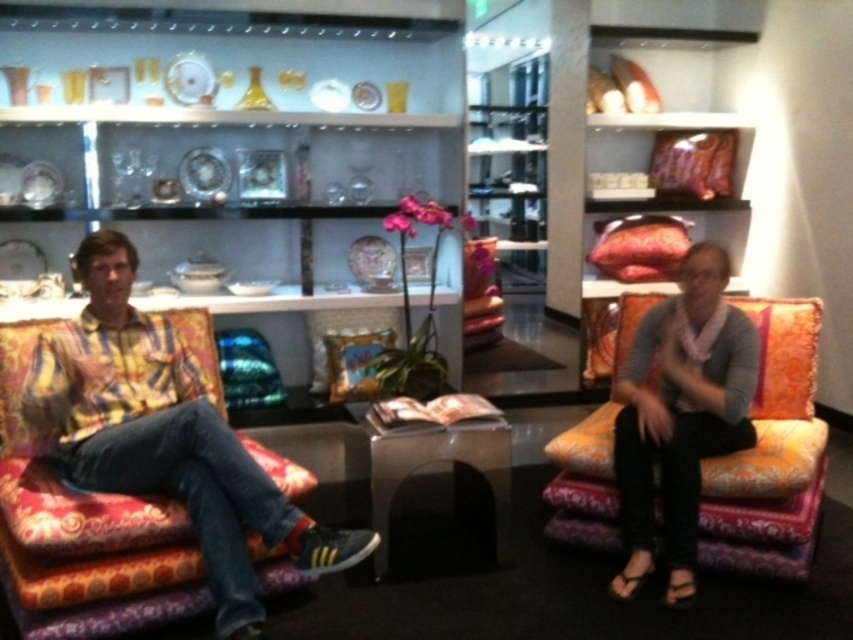
Question: Does printed fabric shirt at left lie in front of matte yellow shirt at center?

Choices:
 (A) no
 (B) yes

Answer: (B)

Question: Considering the real-world distances, which object is farthest from the matte yellow shirt at center?

Choices:
 (A) printed fabric shirt at left
 (B) orange patterned fabric couch at center
 (C) black glossy side table at center

Answer: (A)

Question: Considering the real-world distances, which object is closest to the printed fabric shirt at left?

Choices:
 (A) black glossy side table at center
 (B) matte yellow shirt at center
 (C) orange patterned fabric couch at center

Answer: (A)

Question: Which of the following is the closest to the observer?

Choices:
 (A) (624, 600)
 (B) (323, 531)
 (C) (631, 339)

Answer: (B)

Question: Is printed fabric shirt at left bigger than black glossy side table at center?

Choices:
 (A) yes
 (B) no

Answer: (A)

Question: Observing the image, what is the correct spatial positioning of printed fabric shirt at left in reference to black glossy side table at center?

Choices:
 (A) above
 (B) below

Answer: (A)